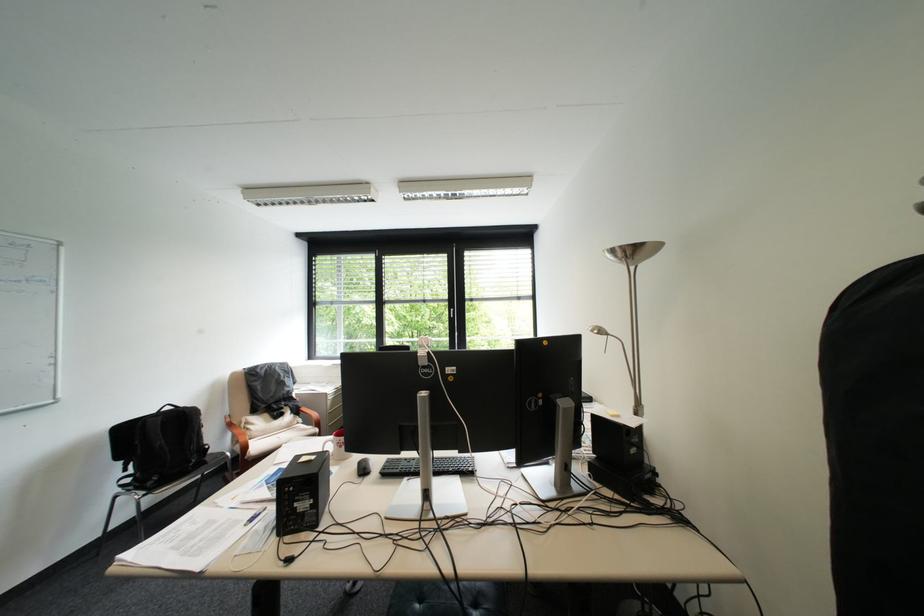
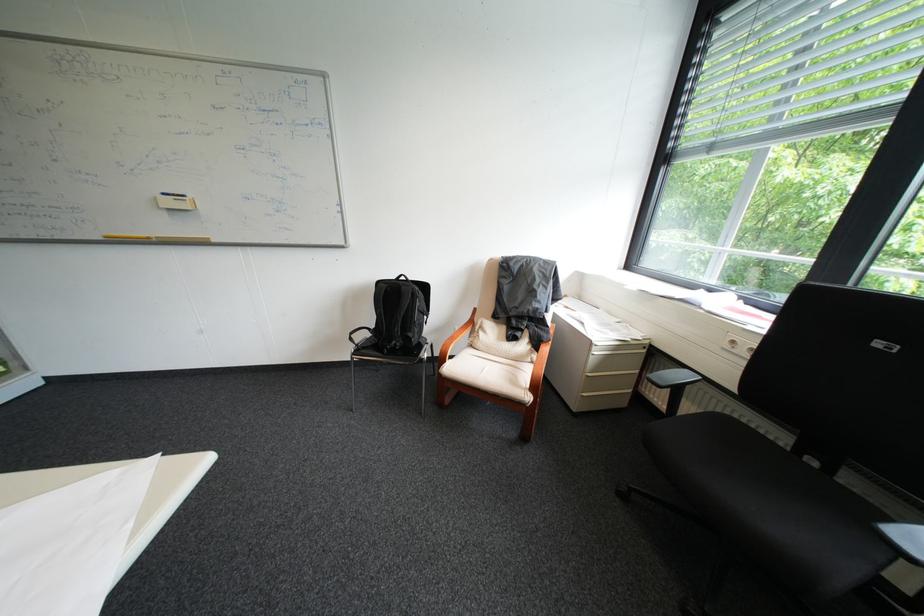
Locate, in the second image, the point that corresponds to (x=198, y=411) in the first image.

(415, 288)